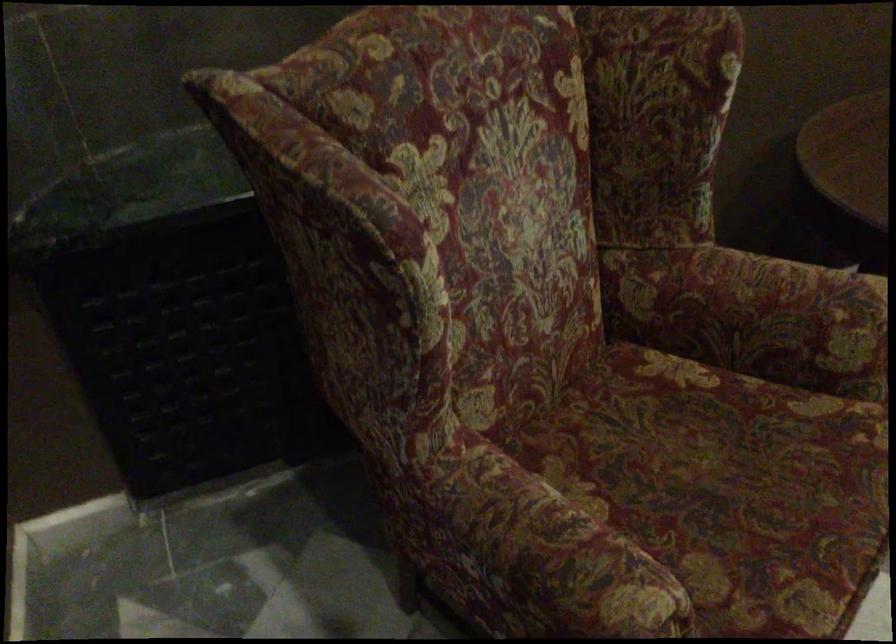
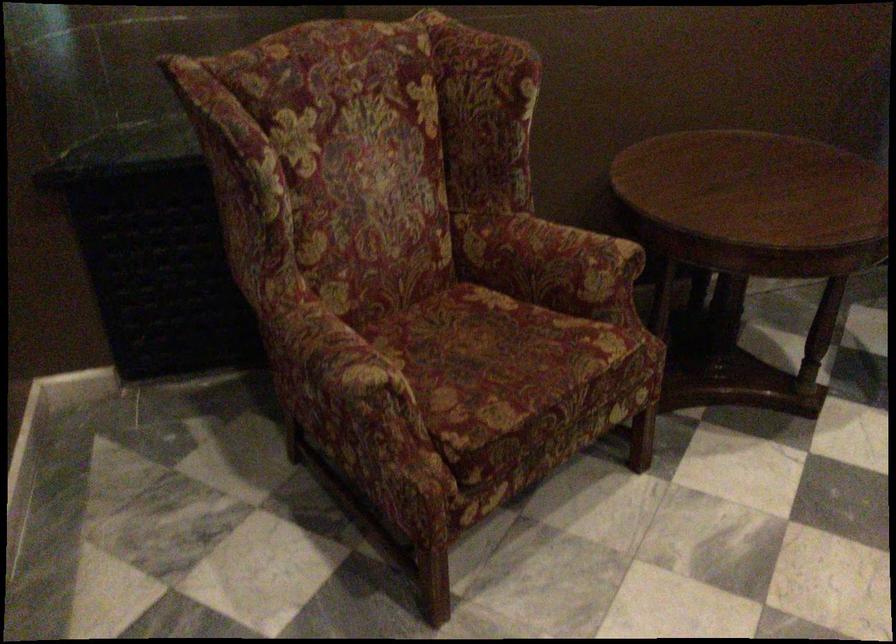
Locate, in the second image, the point that corresponds to point (748, 500) in the first image.

(495, 363)